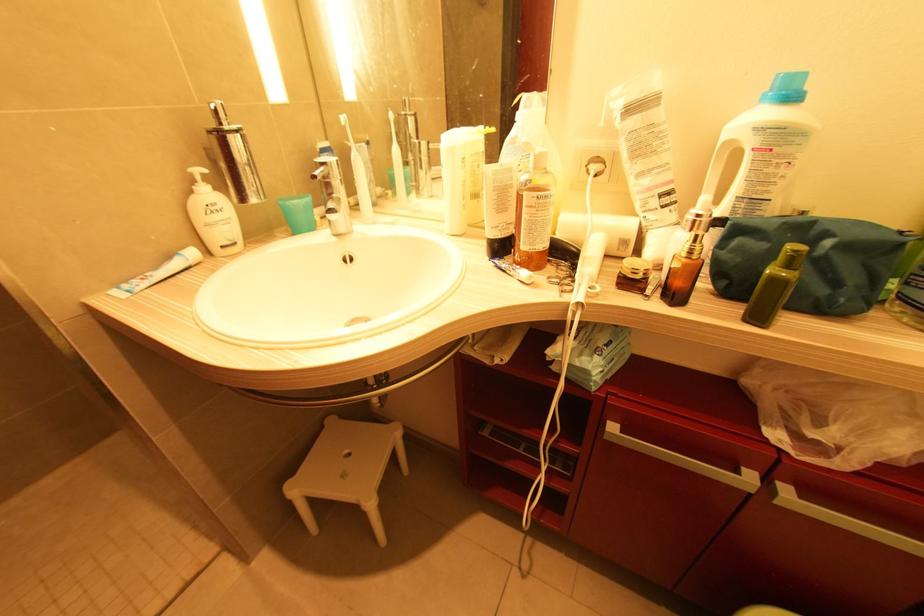
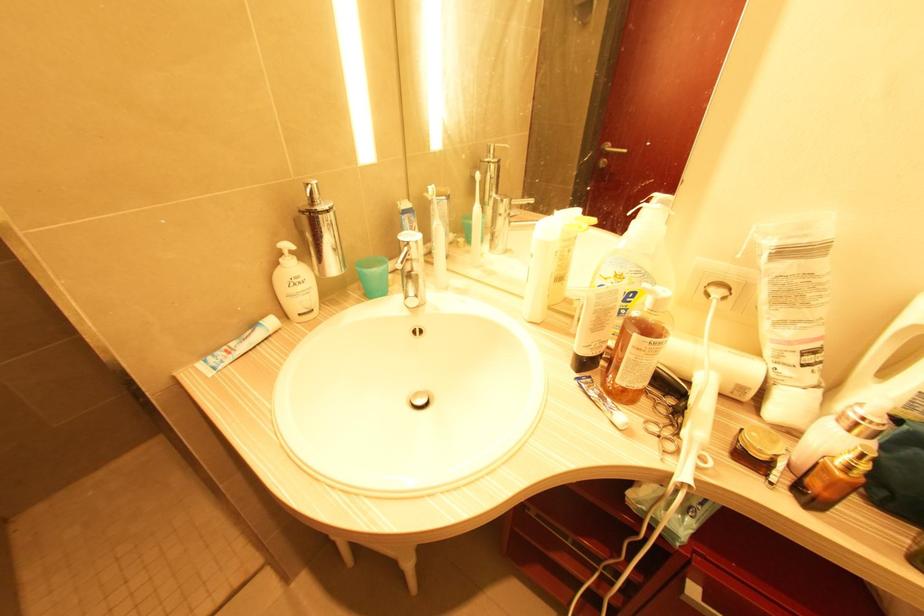
Where in the second image is the point corresponding to point (346, 116) from the first image?

(434, 187)